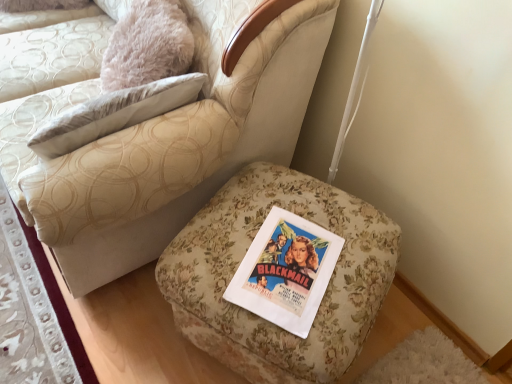
Question: From their relative heights in the image, would you say floral fabric ottoman at lower left is taller or shorter than floral fabric ottoman at center?

Choices:
 (A) tall
 (B) short

Answer: (B)

Question: Is floral fabric ottoman at lower left in front of or behind floral fabric ottoman at center in the image?

Choices:
 (A) behind
 (B) front

Answer: (A)

Question: Which is nearer to the floral fabric ottoman at lower left?

Choices:
 (A) floral fabric ottoman at center
 (B) floral fabric ottoman at lower right

Answer: (A)

Question: Estimate the real-world distances between objects in this image. Which object is closer to the floral fabric ottoman at lower right?

Choices:
 (A) floral fabric ottoman at center
 (B) floral fabric ottoman at lower left

Answer: (A)